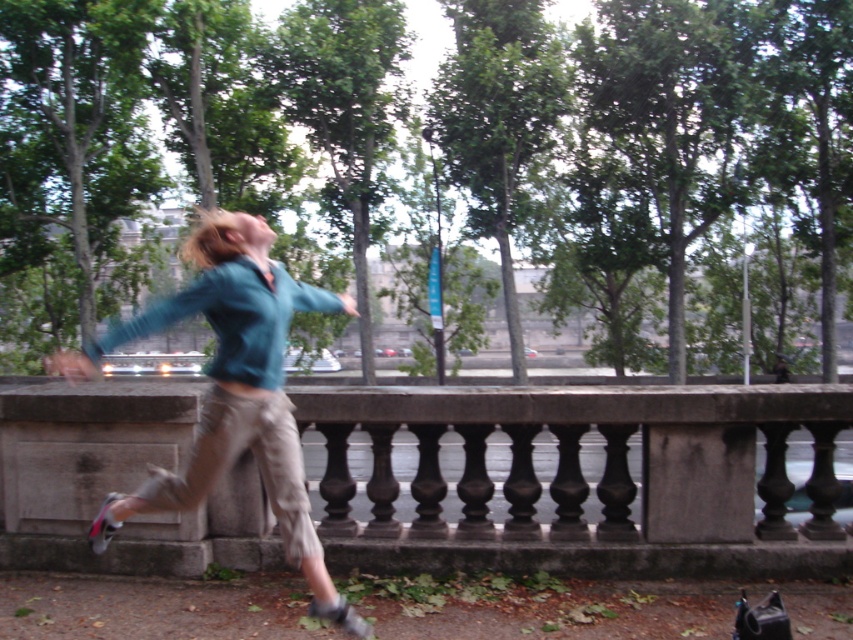
You are a photographer trying to capture the perfect shot of the person dancing. You need to ensure the smooth stone railing at center and the teal fabric shirt at center are both visible in the frame. Based on their positions, which object is closer to the camera?

The teal fabric shirt at center is closer to the camera because the smooth stone railing at center is positioned under it, indicating it is behind the shirt in the scene.

Consider the image. You are a photographer trying to capture the perfect shot of the person dancing. You notice the smooth stone railing at center and the teal fabric shirt at center. Which object should you focus on if you want to highlight something smaller in the scene?

The smooth stone railing at center is smaller than the teal fabric shirt at center, so focusing on the smooth stone railing at center would highlight the smaller object in the scene.

You are a painter setting up an easel to capture the scene. You want to ensure the smooth stone railing at center and the teal fabric shirt at center are both visible in your painting. Which object should you focus on first to ensure it isn t too small in your composition?

The smooth stone railing at center has a lesser width compared to the teal fabric shirt at center, so you should focus on the smooth stone railing at center first to ensure it isn t too small in your composition.